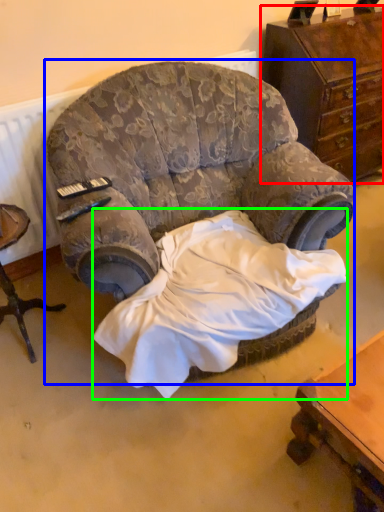
Question: Which object is positioned farthest from chest of drawers (highlighted by a red box)? Select from chair (highlighted by a blue box) and sheet (highlighted by a green box).

Choices:
 (A) chair
 (B) sheet

Answer: (B)